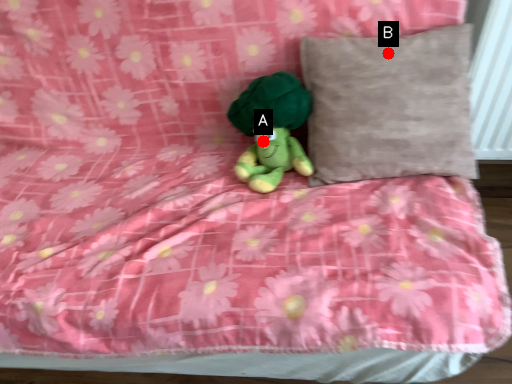
Question: Two points are circled on the image, labeled by A and B beside each circle. Which of the following is the farthest from the observer?

Choices:
 (A) A is further
 (B) B is further

Answer: (A)